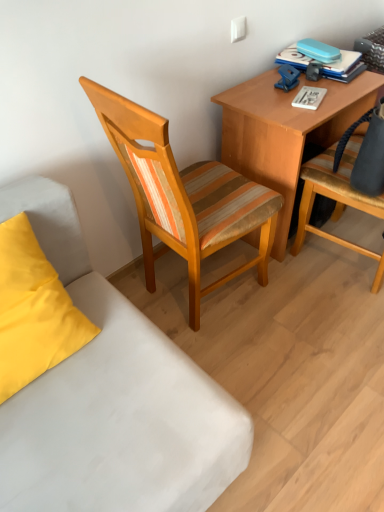
The width and height of the screenshot is (384, 512). Identify the location of free space in front of woodenchair at center, marked as the second chair in a right-to-left arrangement. (264, 372).